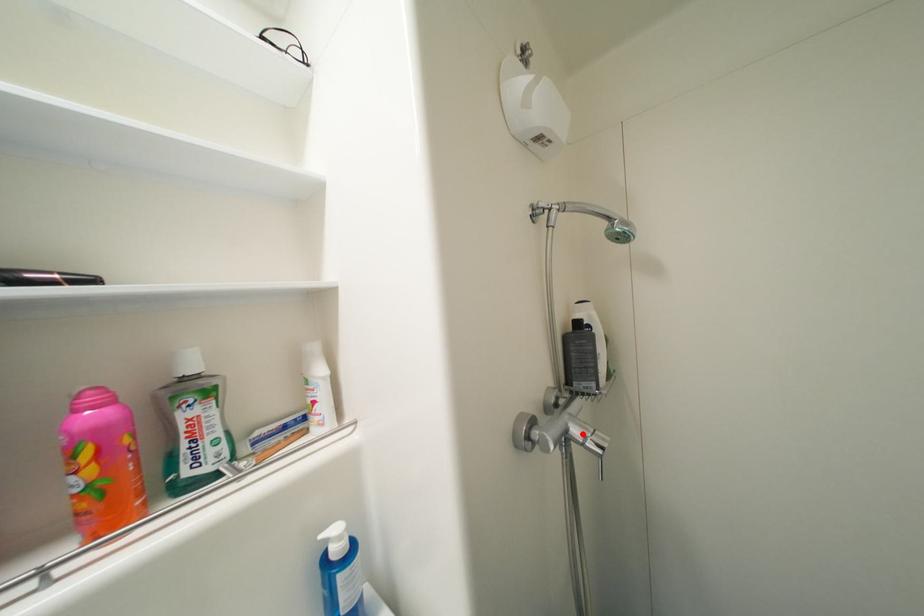
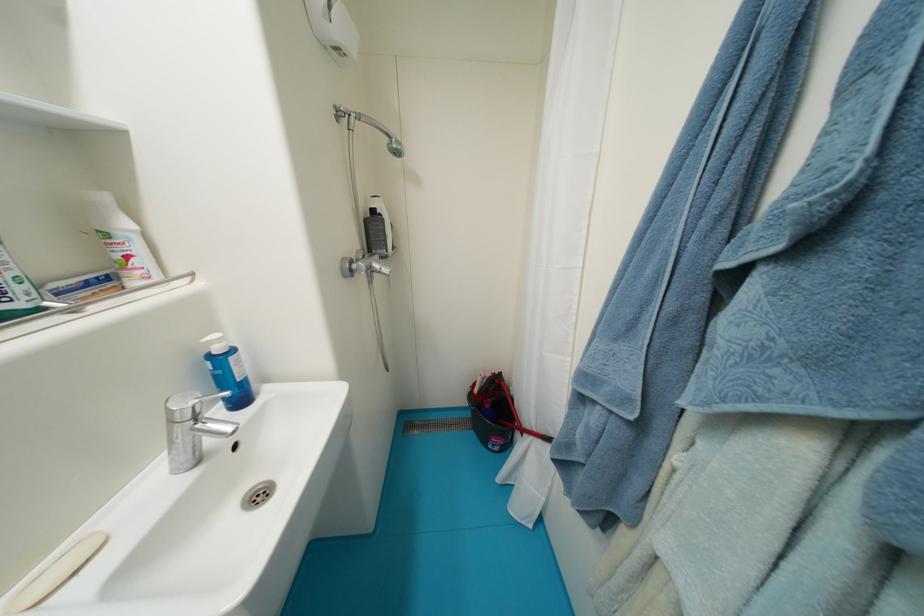
Find the pixel in the second image that matches the highlighted location in the first image.

(383, 267)